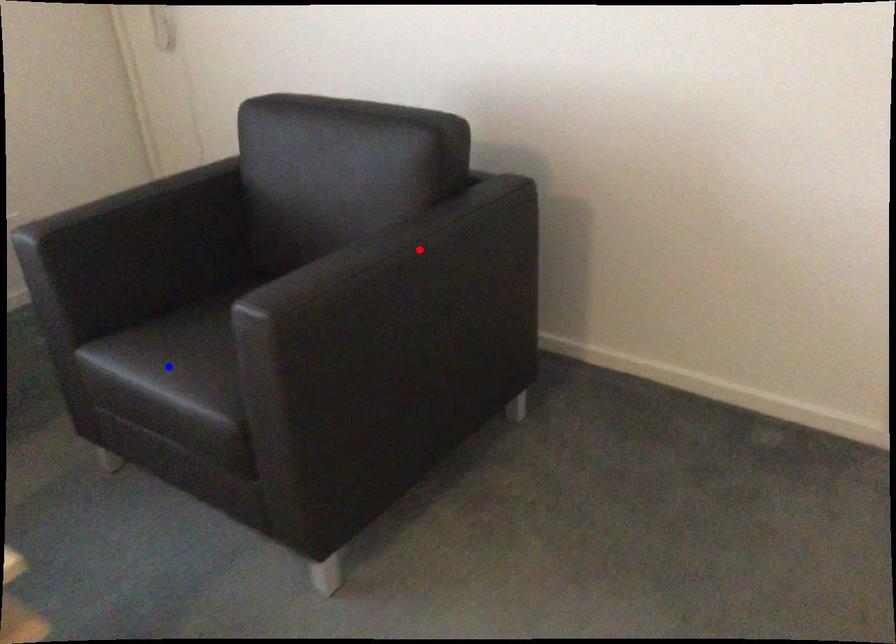
Question: Two points are marked on the image. Which point is closer to the camera?

Choices:
 (A) Blue point is closer.
 (B) Red point is closer.

Answer: (B)